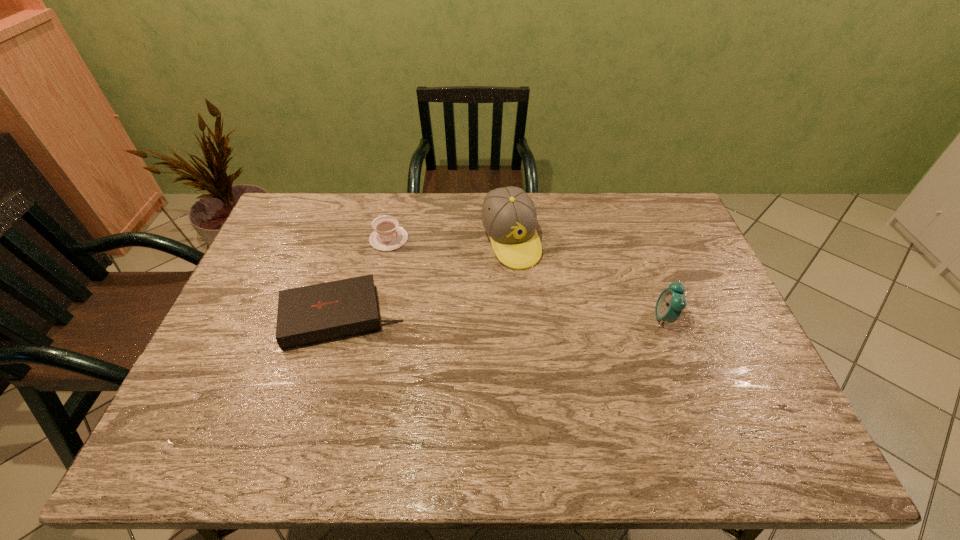
This screenshot has width=960, height=540. I want to click on vacant area that lies between the baseball cap and the shortest object, so click(x=426, y=279).

Where is `vacant point located between the Bible and the second tallest object`? The width and height of the screenshot is (960, 540). vacant point located between the Bible and the second tallest object is located at coordinates (503, 318).

Locate an element on the screen. blank region between the teacup and the second object from right to left is located at coordinates (449, 240).

Find the location of a particular element. The width and height of the screenshot is (960, 540). free space between the rightmost object and the shortest object is located at coordinates (503, 318).

Identify which object is the third closest to the shortest object. Please provide its 2D coordinates. Your answer should be formatted as a tuple, i.e. [(x, y)], where the tuple contains the x and y coordinates of a point satisfying the conditions above.

[(671, 301)]

This screenshot has width=960, height=540. I want to click on object that is the second closest one to the third tallest object, so click(509, 217).

Where is `vacant region that satisfies the following two spatial constraints: 1. on the back side of the Bible; 2. on the right side of the second shortest object`? vacant region that satisfies the following two spatial constraints: 1. on the back side of the Bible; 2. on the right side of the second shortest object is located at coordinates click(364, 239).

Find the location of a particular element. The height and width of the screenshot is (540, 960). vacant area in the image that satisfies the following two spatial constraints: 1. on the front side of the third tallest object; 2. on the right side of the tallest object is located at coordinates (389, 240).

Where is `free region that satisfies the following two spatial constraints: 1. on the back side of the second shortest object; 2. on the right side of the Bible`? The height and width of the screenshot is (540, 960). free region that satisfies the following two spatial constraints: 1. on the back side of the second shortest object; 2. on the right side of the Bible is located at coordinates (364, 239).